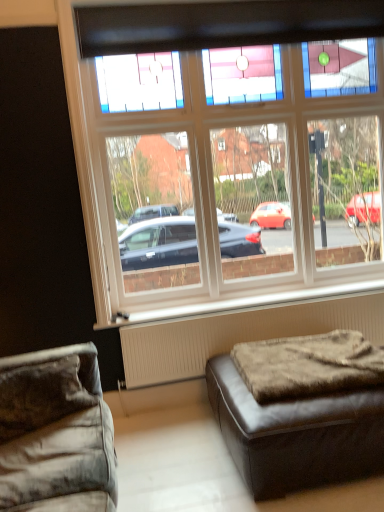
Where is `free space underneath clear glass window at upper center (from a real-world perspective)`? free space underneath clear glass window at upper center (from a real-world perspective) is located at coordinates (249, 300).